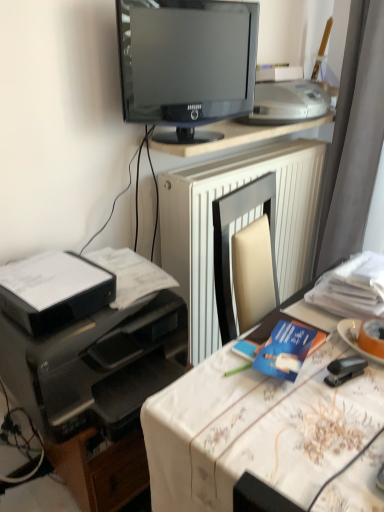
Locate an element on the screen. free space above black plastic printer at lower left, acting as the 2th printer starting from the bottom (from a real-world perspective) is located at coordinates (49, 272).